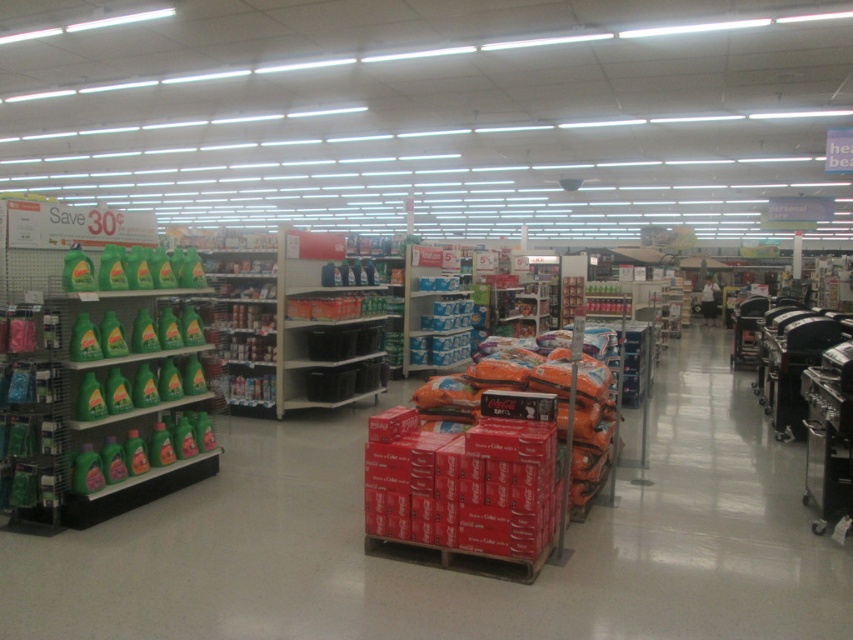
Question: Can you confirm if black plastic shelves at center is bigger than black plastic shopping cart at center-right?

Choices:
 (A) no
 (B) yes

Answer: (A)

Question: Which point appears closest to the camera in this image?

Choices:
 (A) (297, 369)
 (B) (741, 310)

Answer: (A)

Question: Is black plastic shelves at center to the left of black plastic shopping cart at center-right from the viewer's perspective?

Choices:
 (A) yes
 (B) no

Answer: (A)

Question: Does black plastic shelves at center have a smaller size compared to black plastic shopping cart at center-right?

Choices:
 (A) yes
 (B) no

Answer: (A)